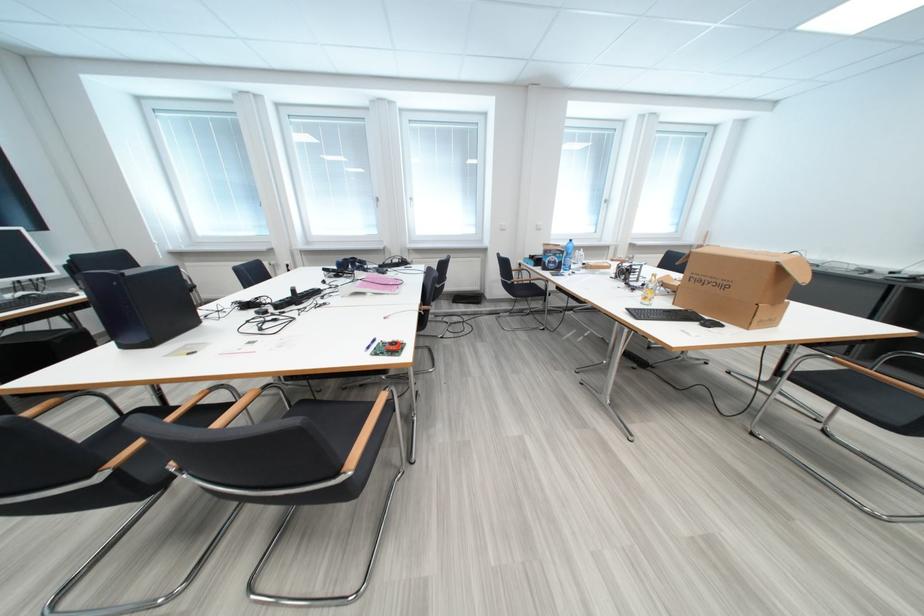
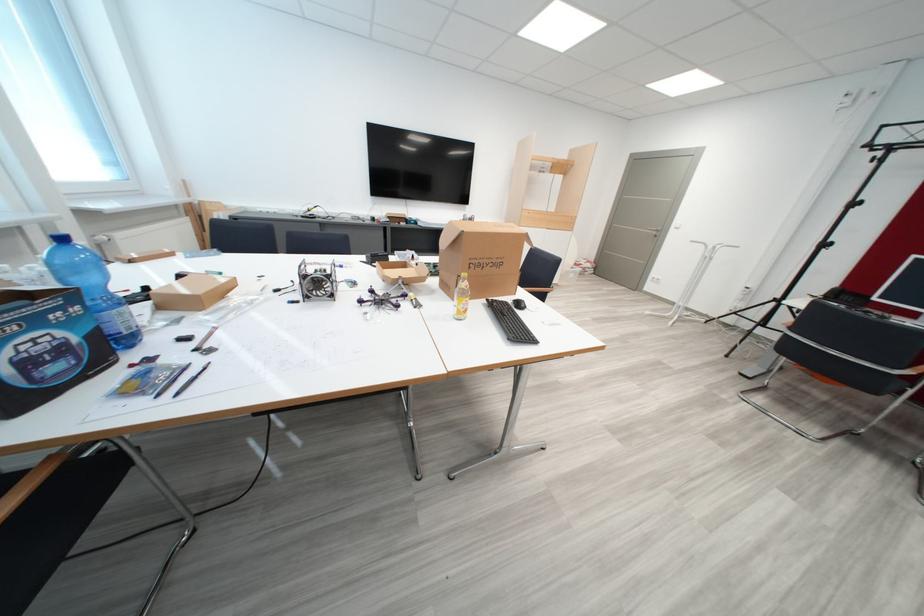
In the second image, find the point that corresponds to (626,278) in the first image.

(317, 300)